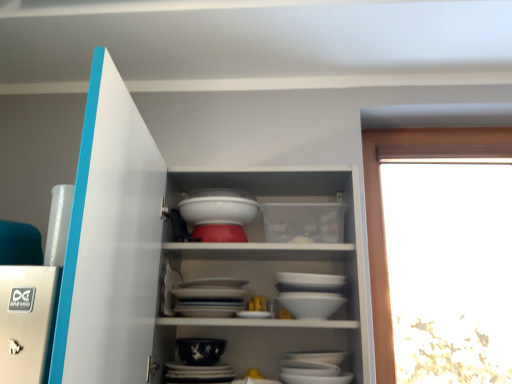
Locate an element on the screen. This screenshot has height=384, width=512. white glossy cupboard at center is located at coordinates (113, 242).

I want to click on dark blue porcelain bowl at center, so click(200, 350).

The width and height of the screenshot is (512, 384). Find the location of `white glossy cupboard at center`. white glossy cupboard at center is located at coordinates (113, 242).

Is dark blue porcelain bowl at center at the back of white glossy bowl at center?

No, white glossy bowl at center's orientation is not away from dark blue porcelain bowl at center.

Is point (239, 218) positioned in front of point (184, 353)?

That is False.

From the image's perspective, which is below, white glossy bowl at center or dark blue porcelain bowl at center?

dark blue porcelain bowl at center is shown below in the image.

Is dark blue porcelain bowl at center completely or partially inside white glossy bowl at center?

No, dark blue porcelain bowl at center is located outside of white glossy bowl at center.

Considering the sizes of objects white glossy bowl at center and white glossy cupboard at center in the image provided, who is bigger, white glossy bowl at center or white glossy cupboard at center?

With larger size is white glossy cupboard at center.

Is white glossy bowl at center spatially inside white glossy cupboard at center, or outside of it?

white glossy bowl at center is spatially positioned inside white glossy cupboard at center.

From the image's perspective, is white glossy bowl at center above or below white glossy cupboard at center?

Clearly, from the image's perspective, white glossy bowl at center is above white glossy cupboard at center.

Considering the relative positions of white glossy bowl at center and white glossy cupboard at center in the image provided, is white glossy bowl at center to the left or to the right of white glossy cupboard at center?

white glossy bowl at center is to the left of white glossy cupboard at center.

From the picture: From the image's perspective, which is above, dark blue porcelain bowl at center or white glossy cupboard at center?

From the image's view, white glossy cupboard at center is above.

The width and height of the screenshot is (512, 384). Identify the location of bowl that is on the left side of white glossy cupboard at center. (200, 350).

Is dark blue porcelain bowl at center not within white glossy cupboard at center?

No.

Which object is wider, dark blue porcelain bowl at center or white glossy cupboard at center?

white glossy cupboard at center is wider.

Considering the relative positions of white glossy cupboard at center and dark blue porcelain bowl at center in the image provided, is white glossy cupboard at center to the left or to the right of dark blue porcelain bowl at center?

Based on their positions, white glossy cupboard at center is located to the right of dark blue porcelain bowl at center.

Which object is closer to the camera taking this photo, white glossy cupboard at center or dark blue porcelain bowl at center?

white glossy cupboard at center is in front.

I want to click on cupboard that is above the dark blue porcelain bowl at center (from the image's perspective), so click(113, 242).

Is white glossy cupboard at center not inside dark blue porcelain bowl at center?

Indeed, white glossy cupboard at center is completely outside dark blue porcelain bowl at center.

Which is correct: dark blue porcelain bowl at center is inside white glossy bowl at center, or outside of it?

dark blue porcelain bowl at center is not inside white glossy bowl at center, it's outside.

Is dark blue porcelain bowl at center oriented away from white glossy bowl at center?

No, white glossy bowl at center is not at the back of dark blue porcelain bowl at center.

From a real-world perspective, which is physically below, dark blue porcelain bowl at center or white glossy bowl at center?

dark blue porcelain bowl at center.

This screenshot has width=512, height=384. In order to click on tableware lying on the right of dark blue porcelain bowl at center in this screenshot , I will do `click(218, 214)`.

Is white glossy cupboard at center to the right of white glossy bowl at center from the viewer's perspective?

Indeed, white glossy cupboard at center is positioned on the right side of white glossy bowl at center.

Image resolution: width=512 pixels, height=384 pixels. Identify the location of tableware above the white glossy cupboard at center (from the image's perspective). (218, 214).

Which of these two, white glossy cupboard at center or white glossy bowl at center, is wider?

white glossy cupboard at center.

Considering the sizes of white glossy cupboard at center and white glossy bowl at center in the image, is white glossy cupboard at center bigger or smaller than white glossy bowl at center?

Considering their sizes, white glossy cupboard at center takes up more space than white glossy bowl at center.

I want to click on bowl below the white glossy bowl at center (from the image's perspective), so click(200, 350).

Locate an element on the screen. The image size is (512, 384). tableware located on the left of white glossy cupboard at center is located at coordinates (218, 214).

Considering their positions, is dark blue porcelain bowl at center positioned further to white glossy bowl at center than white glossy cupboard at center?

dark blue porcelain bowl at center.

Estimate the real-world distances between objects in this image. Which object is closer to white glossy cupboard at center, dark blue porcelain bowl at center or white glossy bowl at center?

Based on the image, white glossy bowl at center appears to be nearer to white glossy cupboard at center.

Estimate the real-world distances between objects in this image. Which object is further from dark blue porcelain bowl at center, white glossy cupboard at center or white glossy bowl at center?

white glossy cupboard at center is further to dark blue porcelain bowl at center.

Looking at this image, estimate the real-world distances between objects in this image. Which object is closer to white glossy bowl at center, white glossy cupboard at center or dark blue porcelain bowl at center?

Among the two, white glossy cupboard at center is located nearer to white glossy bowl at center.

Looking at the image, which one is located further to white glossy cupboard at center, white glossy bowl at center or dark blue porcelain bowl at center?

dark blue porcelain bowl at center is positioned further to the anchor white glossy cupboard at center.

Estimate the real-world distances between objects in this image. Which object is closer to dark blue porcelain bowl at center, white glossy bowl at center or white glossy cupboard at center?

Based on the image, white glossy bowl at center appears to be nearer to dark blue porcelain bowl at center.

The image size is (512, 384). I want to click on bowl between white glossy cupboard at center and white glossy bowl at center from front to back, so click(200, 350).